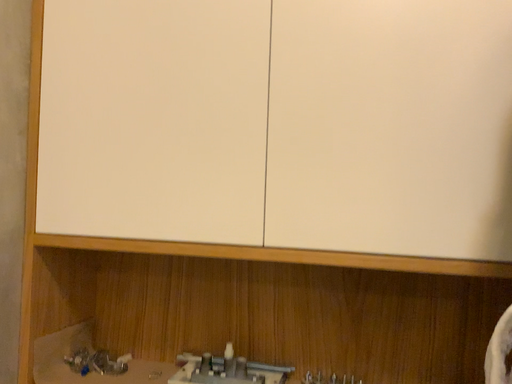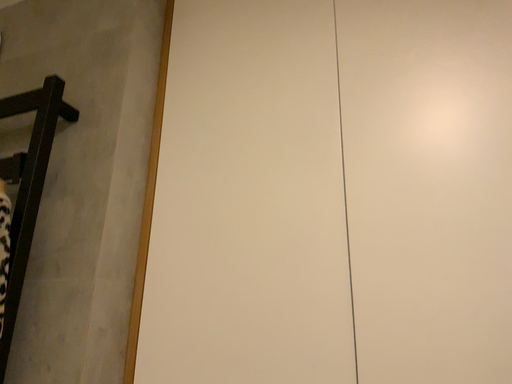
Question: How did the camera likely rotate when shooting the video?

Choices:
 (A) rotated upward
 (B) rotated downward

Answer: (A)